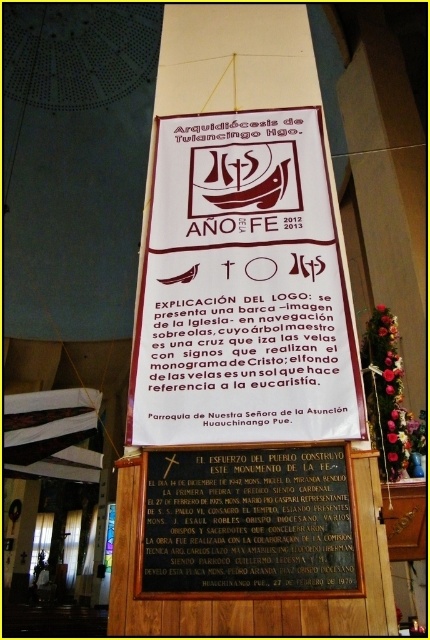
Question: Among these objects, which one is farthest from the camera?

Choices:
 (A) black polished stone plaque at center
 (B) white paper banner at center

Answer: (B)

Question: Which point is farther to the camera?

Choices:
 (A) (294, 364)
 (B) (141, 593)

Answer: (A)

Question: Can you confirm if white paper banner at center is positioned below black polished stone plaque at center?

Choices:
 (A) yes
 (B) no

Answer: (B)

Question: Is white paper banner at center above black polished stone plaque at center?

Choices:
 (A) yes
 (B) no

Answer: (A)

Question: Which object appears farthest from the camera in this image?

Choices:
 (A) white paper banner at center
 (B) black polished stone plaque at center

Answer: (A)

Question: Does white paper banner at center have a smaller size compared to black polished stone plaque at center?

Choices:
 (A) no
 (B) yes

Answer: (A)